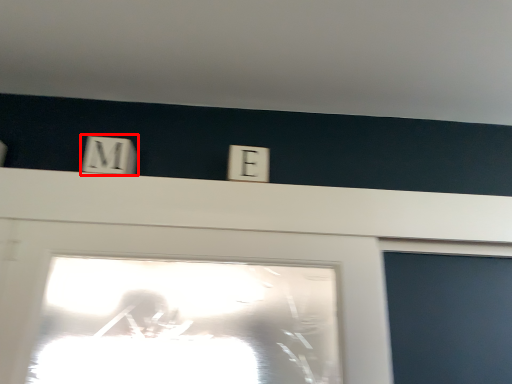
Question: Considering the relative positions of light switch (annotated by the red box) and electric outlet in the image provided, where is light switch (annotated by the red box) located with respect to the staircase?

Choices:
 (A) right
 (B) left

Answer: (B)